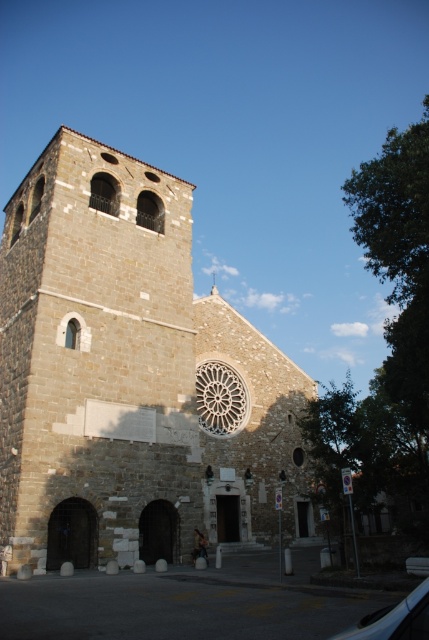
Is brown stone church at center thinner than black rubber car at lower right?

No.

Is brown stone church at center to the left of black rubber car at lower right from the viewer's perspective?

Correct, you'll find brown stone church at center to the left of black rubber car at lower right.

Who is more forward, (x=12, y=404) or (x=398, y=602)?

Point (x=398, y=602)

This screenshot has height=640, width=429. What are the coordinates of `brown stone church at center` in the screenshot? It's located at (132, 378).